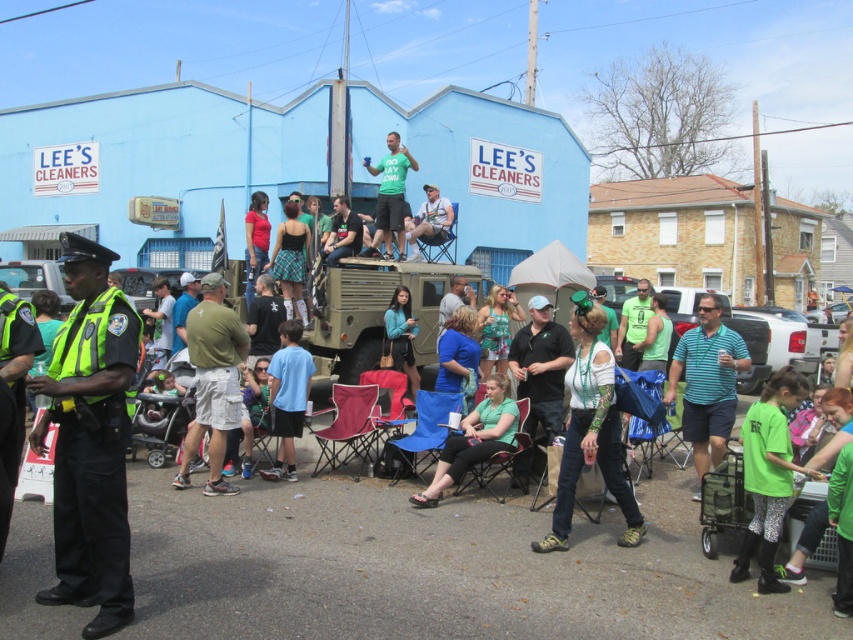
You are a photographer trying to capture a clear shot of both the blue cotton shirt at center and the light blue fabric chair at center. Since you want both subjects to be fully visible in the frame, which one should you adjust your camera angle to focus on first?

The blue cotton shirt at center is taller than the light blue fabric chair at center. To ensure both are fully visible, focus on the blue cotton shirt at center first to adjust the camera angle for its height, then frame the light blue fabric chair at center accordingly.

You are a photographer trying to capture a photo of the white matte pickup truck at center and the light blue fabric chair at center from above. Which object should you focus on first to ensure both are in frame?

You should focus on the light blue fabric chair at center first because the white matte pickup truck at center is located below it, ensuring the chair remains in the frame while capturing the truck below.